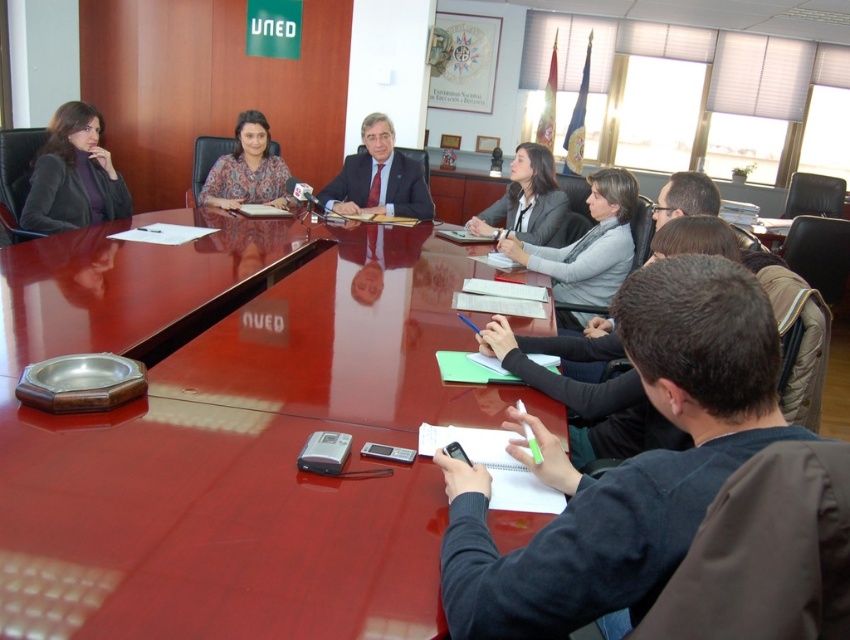
You are a guest at a formal meeting in the conference room. You need to place a name tag on the table. Where should you place it to avoid covering the dark blue sweater at center?

The dark blue sweater at center is located at point (625, 465) on the table. To avoid covering it, place the name tag somewhere else on the table away from that coordinate.

You are an event planner organizing a photoshoot in this conference room. You need to place a 1.2 meter wide backdrop between the gray fabric jacket at upper center and the matte gray blazer at upper center on the table. Is there enough space between them to accommodate the backdrop?

The gray fabric jacket at upper center might be wider than matte gray blazer at upper center, but the exact distance between them is not provided. Without knowing the actual space between the two items, it is uncertain if the 1.2 meter wide backdrop can fit. Additional measurements are needed to confirm.

You are attending a meeting and need to hand a document to the person wearing the dark blue sweater at center and the matte gray blazer at upper center. Which person is seated closer to the front of the conference table?

The dark blue sweater at center is closer to the viewer than the matte gray blazer at upper center, so the person wearing the dark blue sweater at center is seated closer to the front of the conference table.